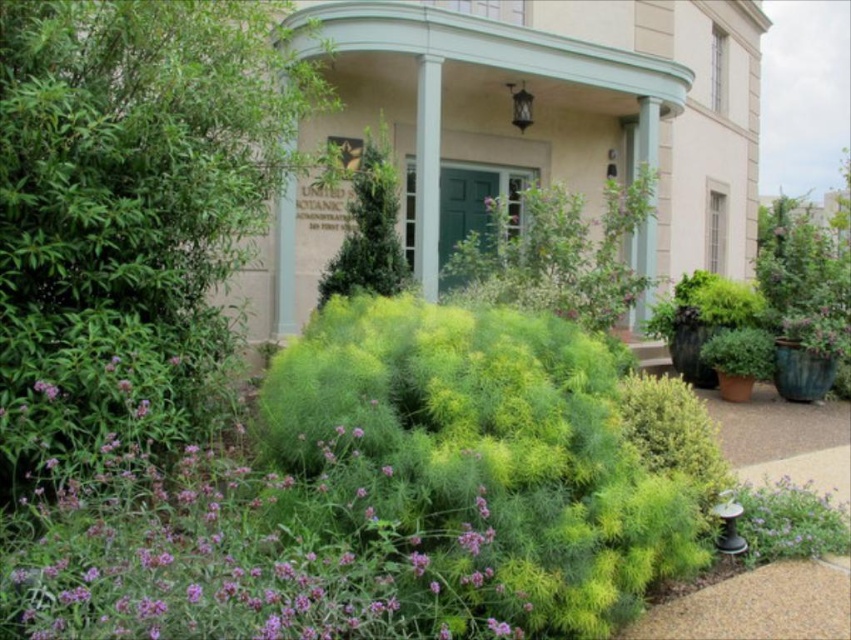
You are a landscape designer planning to place a new statue in the garden. The statue requires a space that can accommodate its base, which is as large as the green leafy bush at center. Is there enough space next to the purple matte flower at lower left to place the statue without overcrowding the area?

The green leafy bush at center is larger in size than the purple matte flower at lower left. Since the statue base requires space as large as the green leafy bush at center, placing it next to the smaller purple matte flower at lower left may not provide sufficient space, leading to overcrowding.

You are standing in front of the United States Botanic Garden Administration building and want to take a photo of the green door. You notice a point at coordinates point (429, 484) in your camera viewfinder. If the camera requires the subject to be at least 3 meters away to focus properly, will the green door be in focus?

The distance of point (429, 484) from the camera is 2.74 meters, which is less than the required 3 meters. Therefore, the green door may not be in focus.

You are standing in front of the United States Botanic Garden Administration building and notice two bushes in the foreground. The first is labeled as a green fluffy bush at center, and the second is a green fuzzy bush at center. Which of these bushes is positioned closer to you?

The green fluffy bush at center is closer to the viewer than the green fuzzy bush at center.